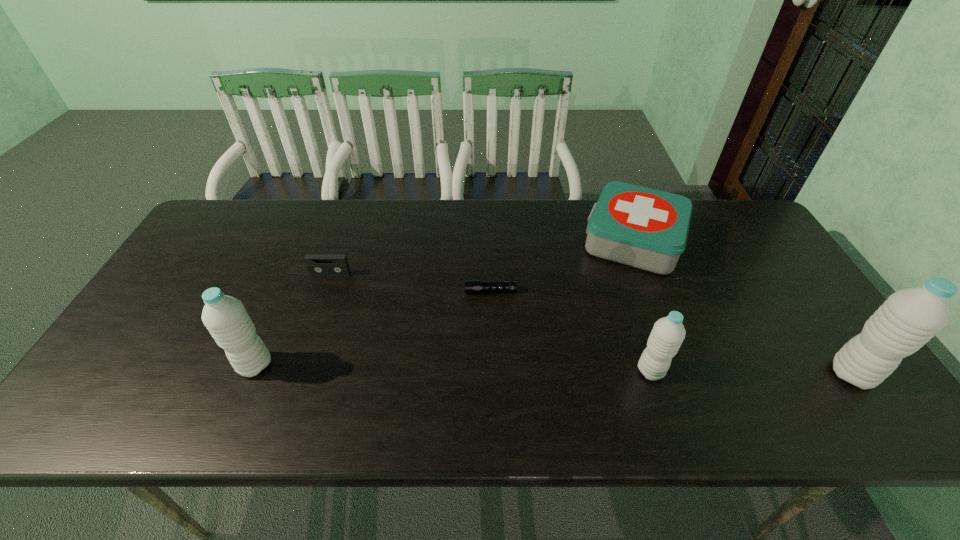
At what (x,y) coordinates should I click in order to perform the action: click on the leftmost object. Please return your answer as a coordinate pair (x, y). Looking at the image, I should click on (225, 317).

Where is `the second tallest water bottle`? The width and height of the screenshot is (960, 540). the second tallest water bottle is located at coordinates (225, 317).

Locate an element on the screen. The height and width of the screenshot is (540, 960). the shortest water bottle is located at coordinates (668, 333).

Where is `the second water bottle from right to left`? The width and height of the screenshot is (960, 540). the second water bottle from right to left is located at coordinates (668, 333).

In order to click on the tallest water bottle in this screenshot , I will do `click(909, 318)`.

Where is `the rightmost water bottle`? the rightmost water bottle is located at coordinates click(x=909, y=318).

The image size is (960, 540). In order to click on the first-aid kit in this screenshot , I will do click(641, 227).

Find the location of a particular element. This screenshot has height=540, width=960. the third farthest object is located at coordinates (471, 286).

The width and height of the screenshot is (960, 540). In order to click on flashlight in this screenshot , I will do `click(471, 286)`.

The width and height of the screenshot is (960, 540). I want to click on videotape, so click(x=318, y=265).